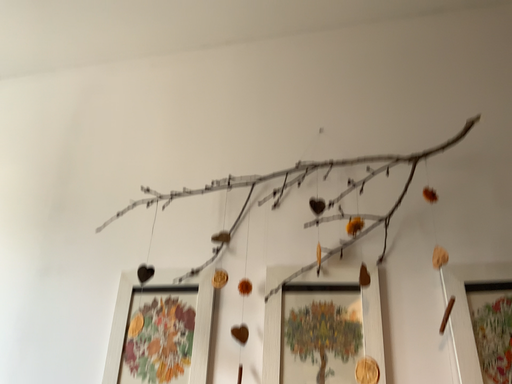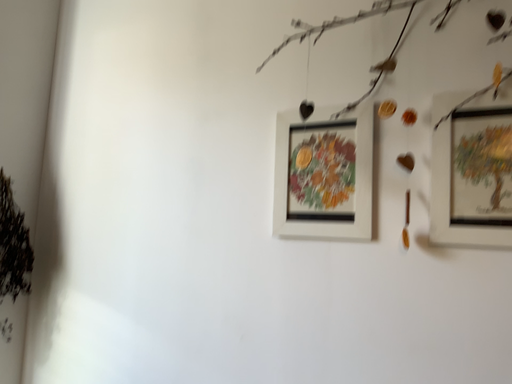
Question: How did the camera likely rotate when shooting the video?

Choices:
 (A) rotated upward
 (B) rotated downward

Answer: (B)